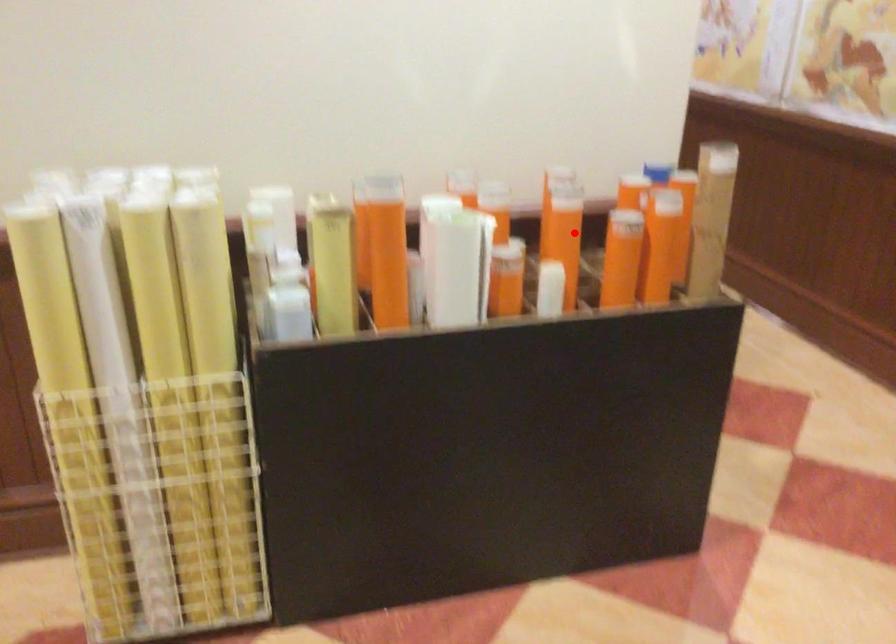
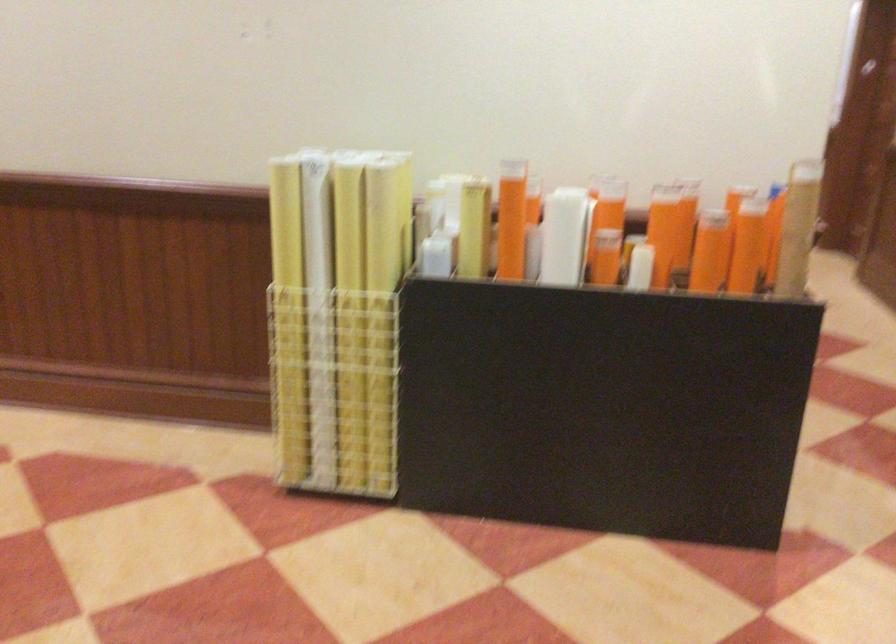
Locate, in the second image, the point that corresponds to the highlighted location in the first image.

(669, 227)